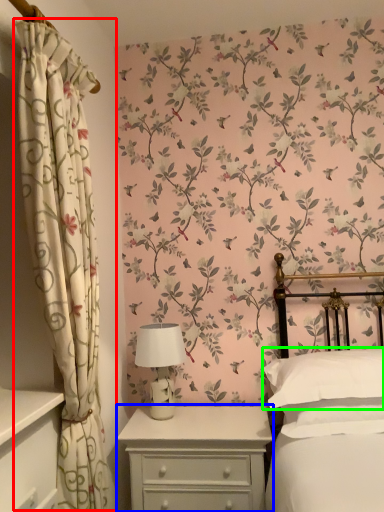
Question: Which is nearer to the curtain (highlighted by a red box)? nightstand (highlighted by a blue box) or pillow (highlighted by a green box).

Choices:
 (A) nightstand
 (B) pillow

Answer: (A)